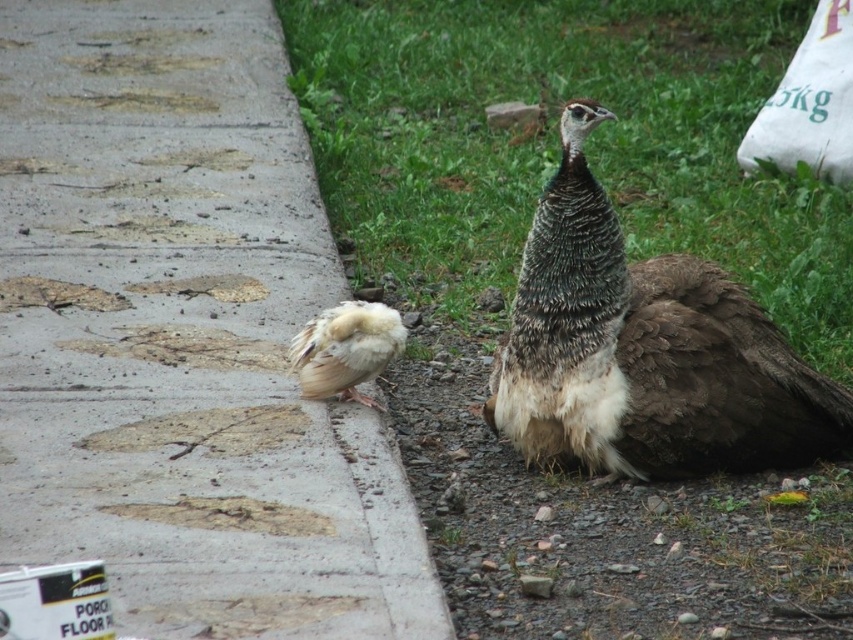
Is green grass at upper center positioned before concrete at left?

That is False.

Which of these two, green grass at upper center or concrete at left, stands shorter?

green grass at upper center

You are a GUI agent. You are given a task and a screenshot of the screen. Output one action in this format:
    pyautogui.click(x=<x>, y=<y>)
    Task: Click on the green grass at upper center
    Image resolution: width=853 pixels, height=640 pixels.
    Given the screenshot: What is the action you would take?
    pyautogui.click(x=630, y=257)

Can you confirm if brown feathered peacock at lower right is smaller than white fluffy feather at left?

Incorrect, brown feathered peacock at lower right is not smaller in size than white fluffy feather at left.

Between brown feathered peacock at lower right and white fluffy feather at left, which one is positioned lower?

brown feathered peacock at lower right

Who is more distant from viewer, [585,161] or [349,381]?

Positioned behind is point [349,381].

The width and height of the screenshot is (853, 640). In order to click on brown feathered peacock at lower right in this screenshot , I will do `click(645, 352)`.

Who is higher up, green grass at upper center or brown feathered peacock at lower right?

Positioned higher is brown feathered peacock at lower right.

Can you confirm if green grass at upper center is bigger than brown feathered peacock at lower right?

Actually, green grass at upper center might be smaller than brown feathered peacock at lower right.

Is point (440, 513) farther from camera compared to point (576, 444)?

That is False.

Find the location of a particular element. green grass at upper center is located at coordinates (630, 257).